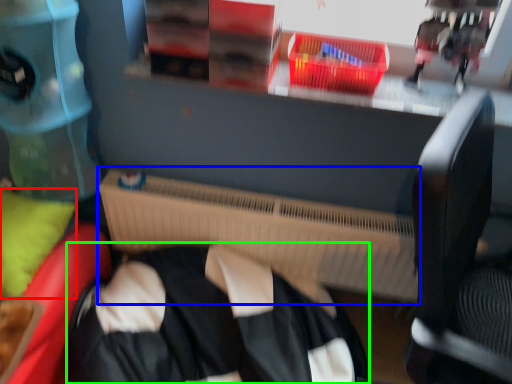
Question: Which object is the closest to the pillow (highlighted by a red box)? Choose among these: radiator (highlighted by a blue box) or clothing (highlighted by a green box).

Choices:
 (A) radiator
 (B) clothing

Answer: (B)